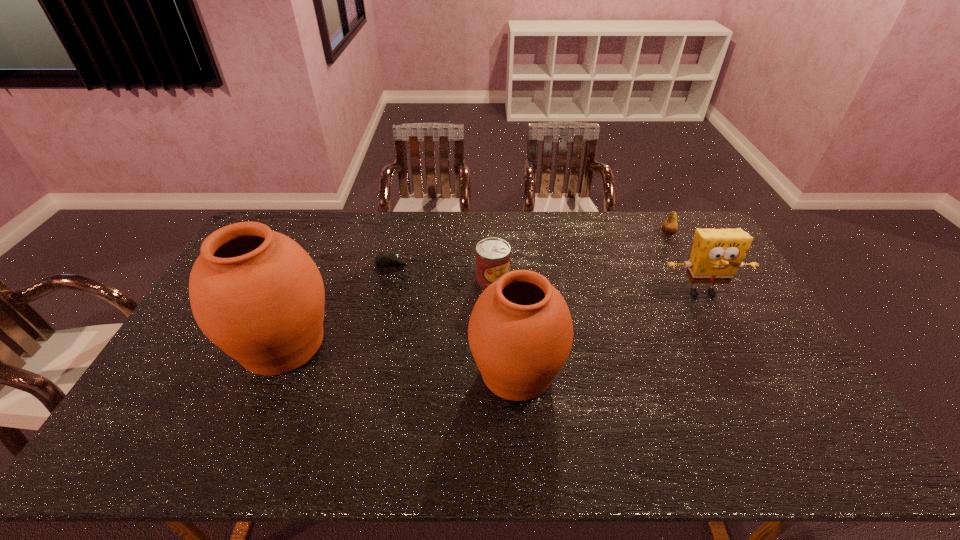
The height and width of the screenshot is (540, 960). Identify the location of the tallest object. (255, 293).

This screenshot has width=960, height=540. Find the location of `the left urn`. the left urn is located at coordinates pos(255,293).

Where is `the shorter urn`? The width and height of the screenshot is (960, 540). the shorter urn is located at coordinates (520, 332).

Image resolution: width=960 pixels, height=540 pixels. Find the location of `the right urn`. the right urn is located at coordinates (520, 332).

You are a GUI agent. You are given a task and a screenshot of the screen. Output one action in this format:
    pyautogui.click(x=<x>, y=<y>)
    Task: Click on the farthest object
    
    Given the screenshot: What is the action you would take?
    pyautogui.click(x=670, y=226)

The height and width of the screenshot is (540, 960). Find the location of `can`. can is located at coordinates (492, 254).

Image resolution: width=960 pixels, height=540 pixels. Find the location of `the second farthest object`. the second farthest object is located at coordinates (386, 259).

Identify the location of computer equipment. (386, 259).

Where is `sponge`? Image resolution: width=960 pixels, height=540 pixels. sponge is located at coordinates (717, 254).

At what (x,y) coordinates should I click in order to perform the action: click on free space located on the right of the leftmost object. Please return your answer as a coordinate pair (x, y). Looking at the image, I should click on (403, 344).